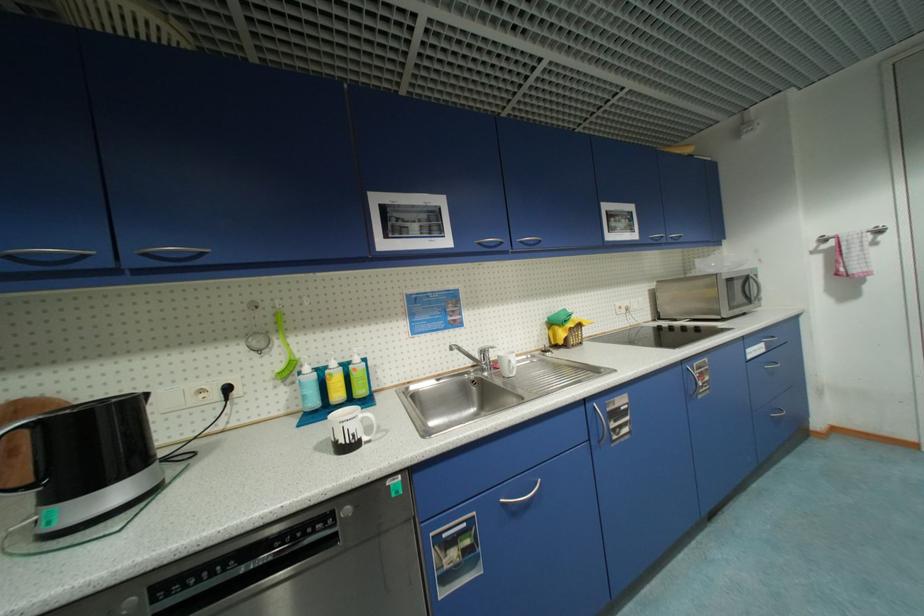
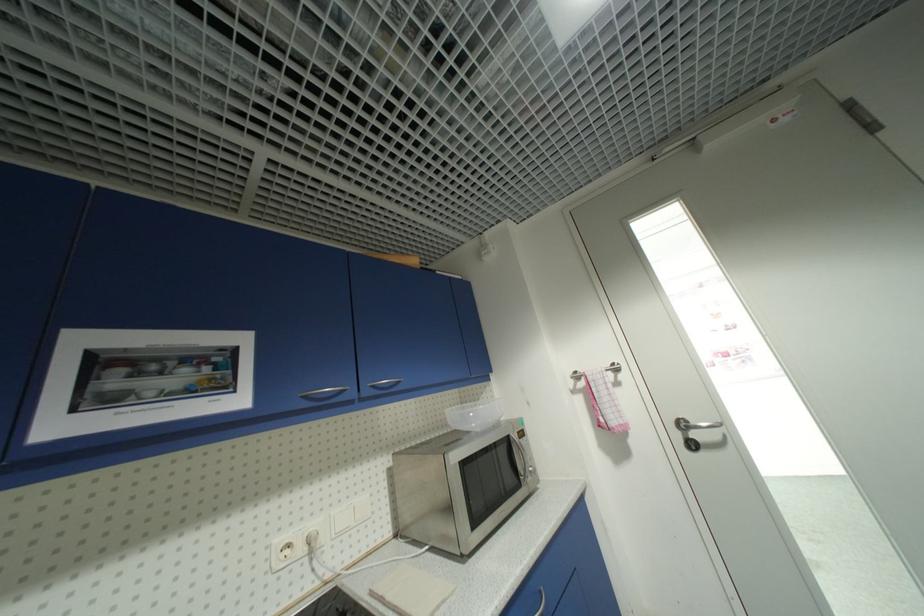
Find the pixel in the second image that matches [626,309] in the first image.

(294, 546)